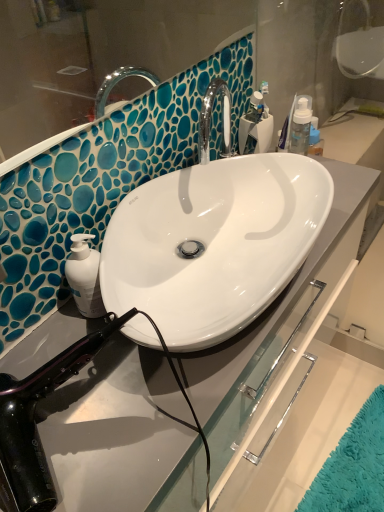
Question: Is clear plastic toothbrush holder at upper right oriented away from black glossy hair dryer at lower left?

Choices:
 (A) yes
 (B) no

Answer: (B)

Question: Would you say clear plastic toothbrush holder at upper right is a long distance from black glossy hair dryer at lower left?

Choices:
 (A) no
 (B) yes

Answer: (A)

Question: Can you confirm if clear plastic toothbrush holder at upper right is taller than black glossy hair dryer at lower left?

Choices:
 (A) yes
 (B) no

Answer: (B)

Question: Does clear plastic toothbrush holder at upper right touch black glossy hair dryer at lower left?

Choices:
 (A) yes
 (B) no

Answer: (B)

Question: Could black glossy hair dryer at lower left be considered to be inside clear plastic toothbrush holder at upper right?

Choices:
 (A) yes
 (B) no

Answer: (B)

Question: From the image's perspective, is clear plastic toothbrush holder at upper right below black glossy hair dryer at lower left?

Choices:
 (A) yes
 (B) no

Answer: (B)

Question: Is black glossy hair dryer at lower left positioned far away from clear plastic toothbrush holder at upper right?

Choices:
 (A) yes
 (B) no

Answer: (B)

Question: From a real-world perspective, is black glossy hair dryer at lower left over clear plastic toothbrush holder at upper right?

Choices:
 (A) yes
 (B) no

Answer: (A)

Question: Is black glossy hair dryer at lower left aimed at clear plastic toothbrush holder at upper right?

Choices:
 (A) yes
 (B) no

Answer: (B)

Question: From a real-world perspective, is black glossy hair dryer at lower left positioned under clear plastic toothbrush holder at upper right based on gravity?

Choices:
 (A) yes
 (B) no

Answer: (B)

Question: Can you confirm if black glossy hair dryer at lower left is smaller than clear plastic toothbrush holder at upper right?

Choices:
 (A) no
 (B) yes

Answer: (A)

Question: Considering the relative positions of black glossy hair dryer at lower left and clear plastic toothbrush holder at upper right in the image provided, is black glossy hair dryer at lower left behind clear plastic toothbrush holder at upper right?

Choices:
 (A) no
 (B) yes

Answer: (A)

Question: Choose the correct answer: Is clear plastic toothbrush holder at upper right inside black glossy hair dryer at lower left or outside it?

Choices:
 (A) inside
 (B) outside

Answer: (B)